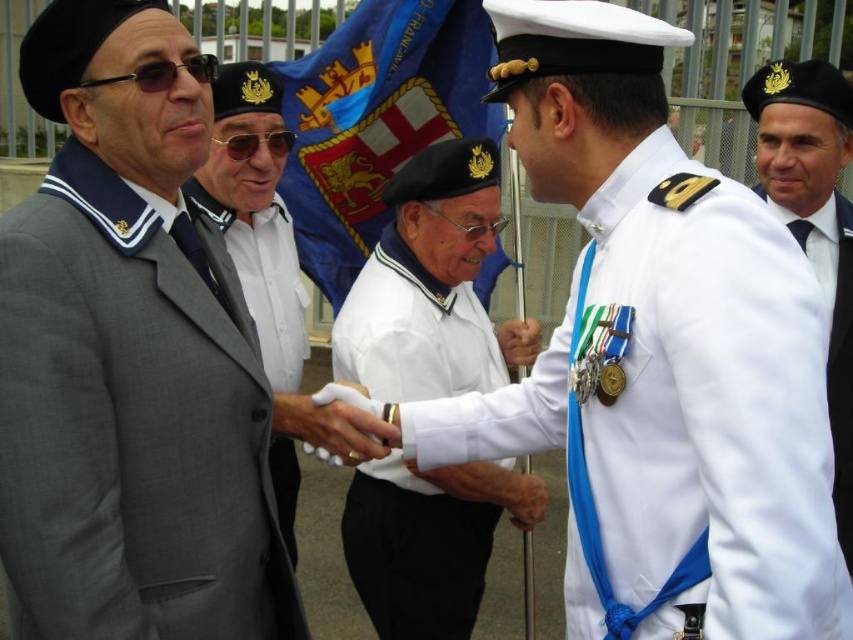
You are a photographer at the event and need to capture a closeup of both the white matte shirt at center and the white smooth shirt at right in a single frame. The camera has a maximum focus range of 2.5 meters. Can you position yourself to take the photo without moving either subject?

The white matte shirt at center is 2.68 meters from the white smooth shirt at right. Since the distance exceeds the camera maximum focus range of 2.5 meters, you cannot capture both subjects in a single frame without moving them.

You are standing at the event and want to take a photo of the point at coordinates point (41, 280). If you need to be within 10 feet to get a clear shot, can you do it?

The distance between point (41, 280) and the viewer is 13.55 feet, which is beyond the 10 feet required for a clear shot. You need to move closer by approximately 3.55 feet to capture a clear image.